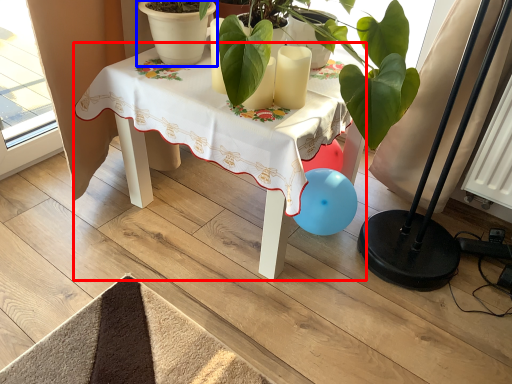
Question: Which of the following is the closest to the observer, table (highlighted by a red box) or flowerpot (highlighted by a blue box)?

Choices:
 (A) table
 (B) flowerpot

Answer: (A)